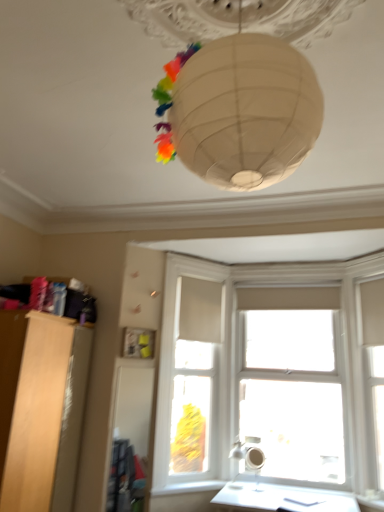
Question: Is point (301, 426) positioned closer to the camera than point (380, 330)?

Choices:
 (A) closer
 (B) farther

Answer: (B)

Question: Considering the relative positions of transparent glass window at center and white matte window frame at right, which is the 1th window frame in right-to-left order, in the image provided, is transparent glass window at center to the left or to the right of white matte window frame at right, which is the 1th window frame in right-to-left order,?

Choices:
 (A) left
 (B) right

Answer: (A)

Question: Estimate the real-world distances between objects in this image. Which object is closer to the white wood window frame at center, arranged as the second window frame when viewed from the right?

Choices:
 (A) transparent glass window at center
 (B) white smooth window sill at lower center
 (C) white matte window frame at right, the 2th window frame from the left
 (D) light wood cabinet at left
 (E) matte white lampshade at lower center

Answer: (A)

Question: Estimate the real-world distances between objects in this image. Which object is farther from the matte white lampshade at lower center?

Choices:
 (A) light wood cabinet at left
 (B) white wood window frame at center, arranged as the second window frame when viewed from the right
 (C) transparent glass window at center
 (D) white smooth window sill at lower center
 (E) white matte window frame at right, the 2th window frame from the left

Answer: (A)